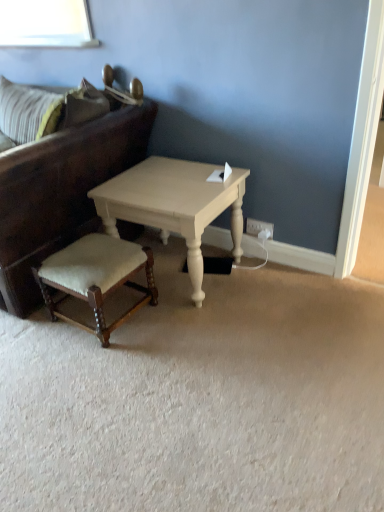
This screenshot has width=384, height=512. What are the coordinates of `free space between velvet beige stool at lower left and white painted wood coffee table at center` in the screenshot? It's located at (154, 323).